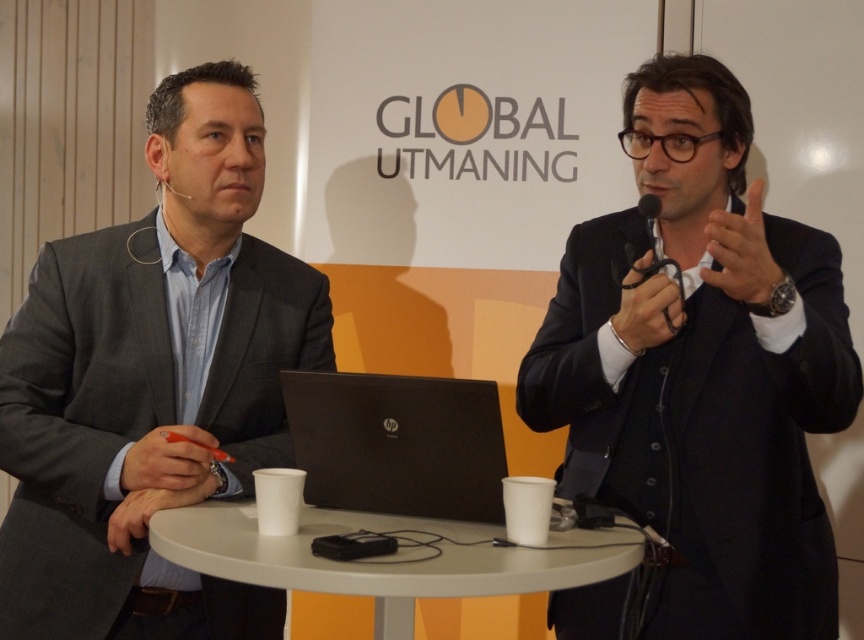
You are a security guard standing at the entrance of the conference hall. You need to check the ID badge of the black matte suit at center. Can you reach them without moving from your current position?

The black matte suit at center is 1.32 meters away from the viewer, so yes, the security guard can reach them without moving from their current position since the distance is manageable.

You are standing at the origin point in the image. Which of the two points, point [316,310] or point [766,260], is located further away from you?

Point [316,310] is behind point [766,260], so it is further away from you.

You are organizing a small meeting and need to seat two people at the white plastic table at center. Given the size of the black matte suit at center, do you think there will be enough space for both attendees?

The black matte suit at center is larger in size than the white plastic table at center, so there may not be enough space for two attendees to sit comfortably at the white plastic table at center.